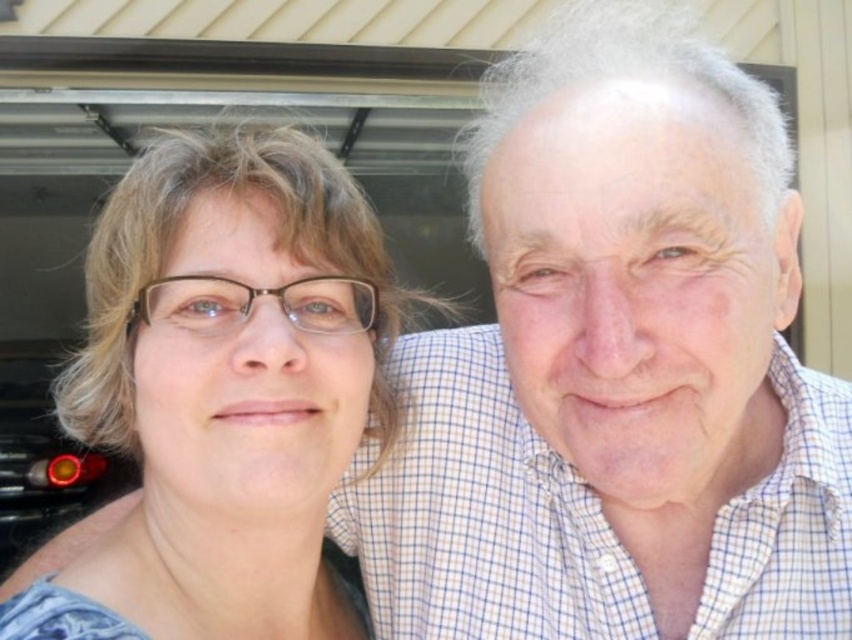
Is point (292, 252) positioned behind point (111, 461)?

No, it is in front of (111, 461).

Who is positioned more to the left, matte blue shirt at center or matte red taillight at lower left?

matte red taillight at lower left is more to the left.

This screenshot has width=852, height=640. What do you see at coordinates (232, 384) in the screenshot?
I see `matte blue shirt at center` at bounding box center [232, 384].

Where is `matte blue shirt at center`? matte blue shirt at center is located at coordinates (232, 384).